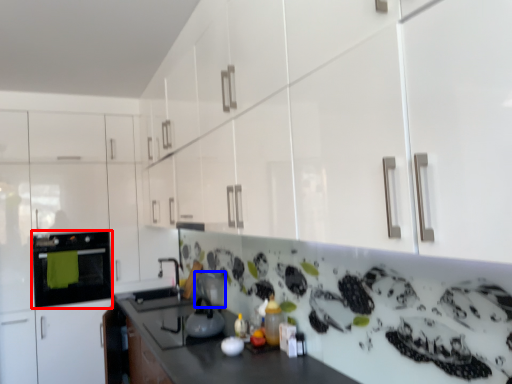
Question: Which object appears closest to the camera in this image, home appliance (highlighted by a red box) or appliance (highlighted by a blue box)?

Choices:
 (A) home appliance
 (B) appliance

Answer: (B)